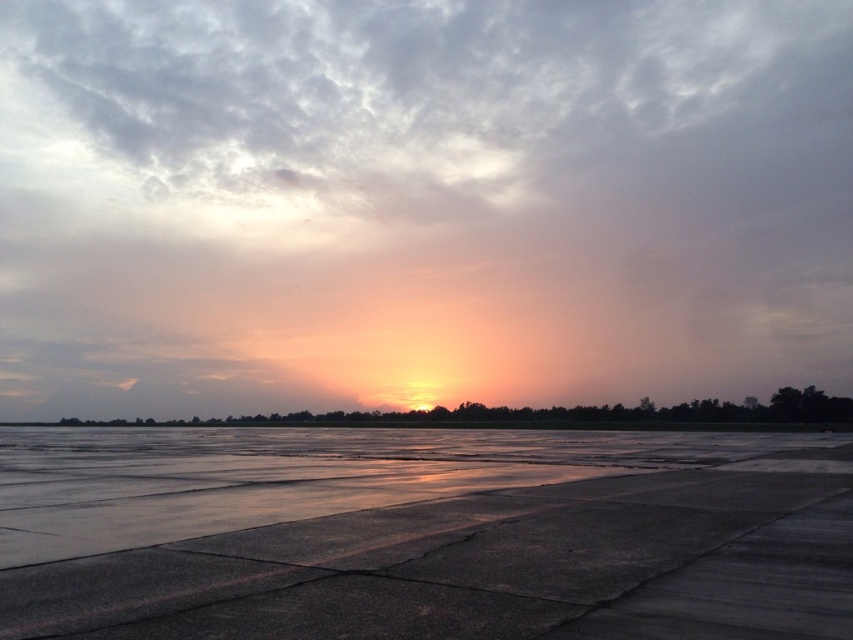
Can you confirm if gray fluffy cloud at upper center is positioned above smooth asphalt tarmac at center?

Yes, gray fluffy cloud at upper center is above smooth asphalt tarmac at center.

Between point (572, 234) and point (431, 573), which one is positioned behind?

The point (572, 234) is behind.

At what (x,y) coordinates should I click in order to perform the action: click on gray fluffy cloud at upper center. Please return your answer as a coordinate pair (x, y). The height and width of the screenshot is (640, 853). Looking at the image, I should click on (421, 202).

Which is more to the left, smooth asphalt tarmac at center or sunset sky at center?

From the viewer's perspective, sunset sky at center appears more on the left side.

Measure the distance between point (334, 616) and camera.

The distance of point (334, 616) from camera is 4.59 meters.

Between point (799, 524) and point (403, 412), which one is positioned behind?

Positioned behind is point (403, 412).

Where is `smooth asphalt tarmac at center`? The width and height of the screenshot is (853, 640). smooth asphalt tarmac at center is located at coordinates (422, 534).

Is gray fluffy cloud at upper center below sunset sky at center?

No.

Can you confirm if gray fluffy cloud at upper center is positioned to the left of sunset sky at center?

Incorrect, gray fluffy cloud at upper center is not on the left side of sunset sky at center.

Is point (605, 225) less distant than point (790, 420)?

No, it is not.

This screenshot has height=640, width=853. Identify the location of gray fluffy cloud at upper center. (421, 202).